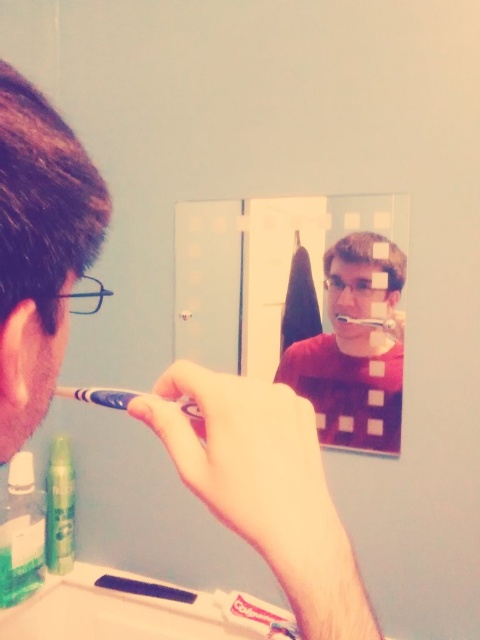
Question: Which object is closer to the camera taking this photo?

Choices:
 (A) blue plastic toothbrush at center
 (B) green matte spray can at lower left
 (C) clear glass mirror at center
 (D) white matte toothpaste at lower center

Answer: (A)

Question: Is clear glass mirror at center bigger than white plastic toothbrush at center?

Choices:
 (A) yes
 (B) no

Answer: (A)

Question: Can you confirm if green matte spray can at lower left is smaller than blue plastic toothbrush at center?

Choices:
 (A) yes
 (B) no

Answer: (B)

Question: Considering the real-world distances, which object is closest to the matte plastic toothbrush at center?

Choices:
 (A) blue plastic toothbrush at center
 (B) green matte spray can at lower left
 (C) white plastic toothbrush at center
 (D) white matte toothpaste at lower center

Answer: (C)

Question: Among these objects, which one is nearest to the camera?

Choices:
 (A) blue plastic toothbrush at center
 (B) white matte toothpaste at lower center

Answer: (A)

Question: Does brown hair at left have a larger size compared to blue plastic toothbrush at center?

Choices:
 (A) no
 (B) yes

Answer: (B)